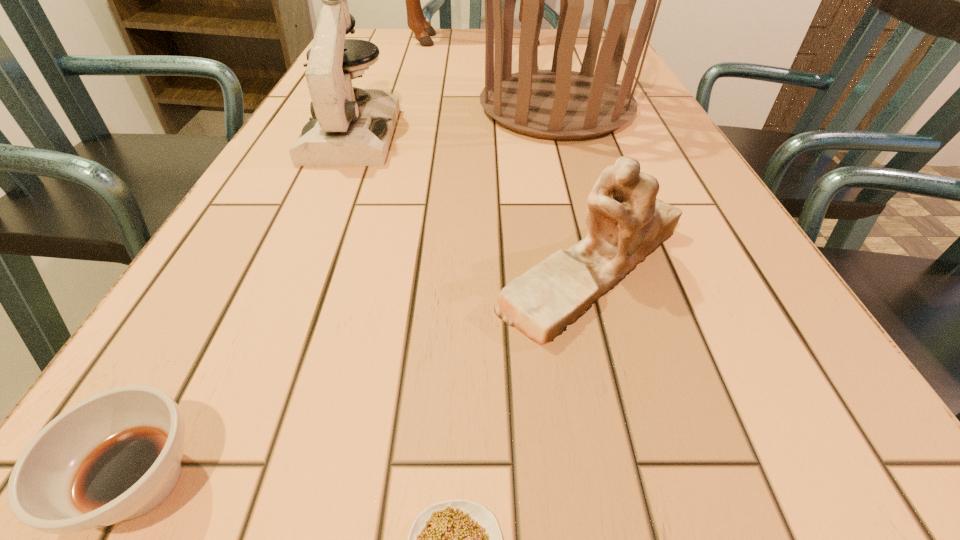
Locate an element on the screen. vacant region located on the front-facing side of the third nearest object is located at coordinates (443, 269).

The image size is (960, 540). I want to click on object that is at the far edge, so [416, 21].

Locate an element on the screen. The width and height of the screenshot is (960, 540). object at the left edge is located at coordinates (348, 126).

Where is `saddle situated at the right edge`? The height and width of the screenshot is (540, 960). saddle situated at the right edge is located at coordinates (416, 21).

The height and width of the screenshot is (540, 960). What are the coordinates of `birdcage at the right edge` in the screenshot? It's located at (559, 104).

Where is `figurine located at the right edge`? This screenshot has width=960, height=540. figurine located at the right edge is located at coordinates (626, 223).

The width and height of the screenshot is (960, 540). I want to click on object positioned at the far right corner, so click(x=416, y=21).

Identify the location of vacant region at the far edge. Image resolution: width=960 pixels, height=540 pixels. (549, 29).

This screenshot has height=540, width=960. I want to click on vacant space at the left edge of the desktop, so click(267, 195).

Find the location of a particular element. This screenshot has height=540, width=960. vacant region at the right edge of the desktop is located at coordinates (661, 133).